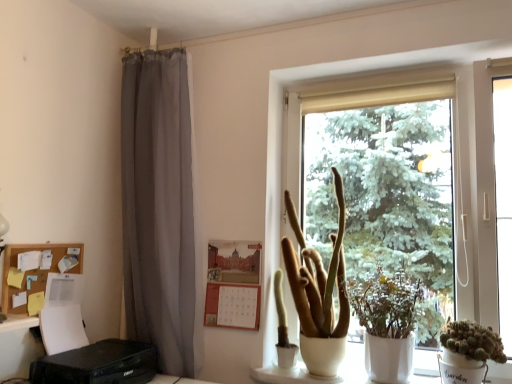
Question: Which direction should I rotate to look at matte white pot at center, which is counted as the third houseplant, starting from the right, — up or down?

Choices:
 (A) down
 (B) up

Answer: (A)

Question: From a real-world perspective, does white matte window at center stand above corkboard paper at left?

Choices:
 (A) yes
 (B) no

Answer: (A)

Question: Can you confirm if white matte window at center is bigger than corkboard paper at left?

Choices:
 (A) no
 (B) yes

Answer: (B)

Question: Is white matte window at center in front of corkboard paper at left?

Choices:
 (A) no
 (B) yes

Answer: (B)

Question: Is white matte window at center outside of corkboard paper at left?

Choices:
 (A) no
 (B) yes

Answer: (B)

Question: Can you confirm if white matte window at center is wider than corkboard paper at left?

Choices:
 (A) yes
 (B) no

Answer: (A)

Question: Would you consider white matte window at center to be distant from corkboard paper at left?

Choices:
 (A) yes
 (B) no

Answer: (A)

Question: Considering the relative sizes of green matte plant at center, the 2th houseplant in the right-to-left sequence, and matte white pot at center, the first houseplant in the left-to-right sequence, in the image provided, is green matte plant at center, the 2th houseplant in the right-to-left sequence, wider than matte white pot at center, the first houseplant in the left-to-right sequence,?

Choices:
 (A) yes
 (B) no

Answer: (B)

Question: Is green matte plant at center, the 2th houseplant in the right-to-left sequence, thinner than matte white pot at center, which is counted as the third houseplant, starting from the right?

Choices:
 (A) yes
 (B) no

Answer: (A)

Question: Is green matte plant at center, the 2th houseplant in the right-to-left sequence, closer to camera compared to matte white pot at center, the first houseplant in the left-to-right sequence?

Choices:
 (A) no
 (B) yes

Answer: (B)

Question: From a real-world perspective, is green matte plant at center, the second houseplant viewed from the left, over matte white pot at center, the first houseplant in the left-to-right sequence?

Choices:
 (A) yes
 (B) no

Answer: (B)

Question: Can you confirm if green matte plant at center, the second houseplant viewed from the left, is taller than matte white pot at center, which is counted as the third houseplant, starting from the right?

Choices:
 (A) no
 (B) yes

Answer: (A)

Question: Is green matte plant at center, the second houseplant viewed from the left, to the right of matte white pot at center, the first houseplant in the left-to-right sequence, from the viewer's perspective?

Choices:
 (A) no
 (B) yes

Answer: (B)

Question: Considering the relative positions of green matte plant at center, the second houseplant viewed from the left, and white matte window at center in the image provided, is green matte plant at center, the second houseplant viewed from the left, behind white matte window at center?

Choices:
 (A) no
 (B) yes

Answer: (A)